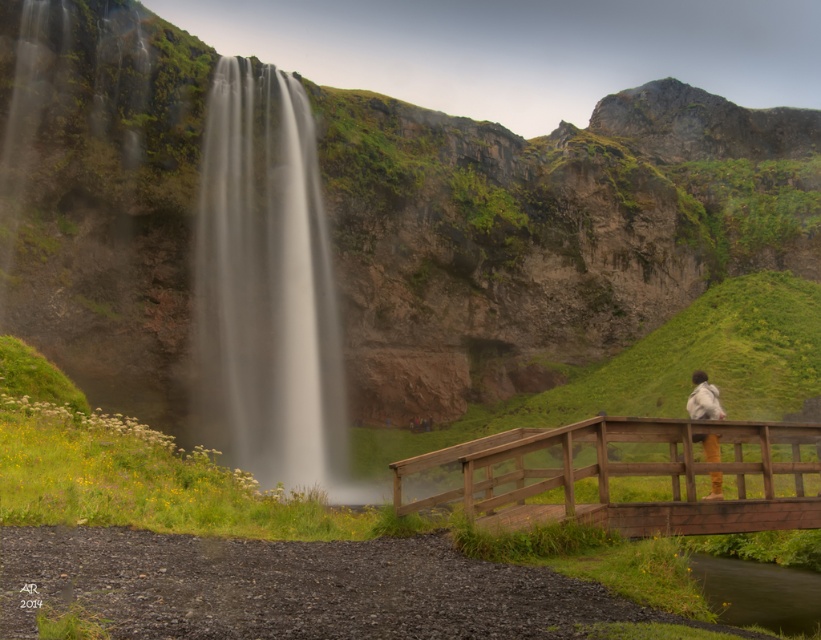
Identify the location of white smooth waterfall at left. The height and width of the screenshot is (640, 821). (265, 284).

Can you confirm if white smooth waterfall at left is taller than light gray fabric jacket at upper right?

Indeed, white smooth waterfall at left has a greater height compared to light gray fabric jacket at upper right.

Which is in front, point (250, 131) or point (711, 436)?

Point (711, 436) is more forward.

Where is `white smooth waterfall at left`? This screenshot has height=640, width=821. white smooth waterfall at left is located at coordinates (265, 284).

Who is higher up, white smooth waterfall at left or wooden bridge at center?

Positioned higher is white smooth waterfall at left.

Does white smooth waterfall at left lie in front of wooden bridge at center?

No, white smooth waterfall at left is further to the viewer.

Identify the location of white smooth waterfall at left. This screenshot has width=821, height=640. (265, 284).

Who is positioned more to the right, wooden bridge at center or light gray fabric jacket at upper right?

Positioned to the right is light gray fabric jacket at upper right.

Does wooden bridge at center have a lesser width compared to light gray fabric jacket at upper right?

No.

Between point (393, 481) and point (695, 384), which one is positioned behind?

The point (695, 384) is more distant.

You are a GUI agent. You are given a task and a screenshot of the screen. Output one action in this format:
    pyautogui.click(x=<x>, y=<y>)
    Task: Click on the wooden bridge at center
    The image size is (821, 640).
    Given the screenshot: What is the action you would take?
    pyautogui.click(x=631, y=474)